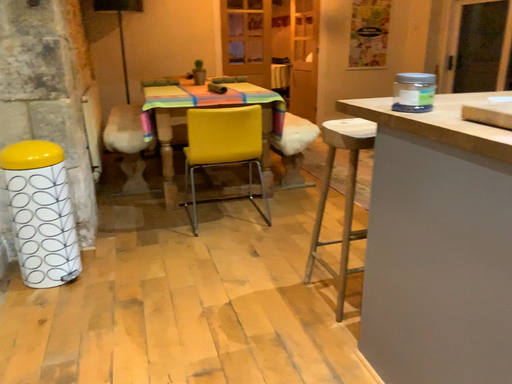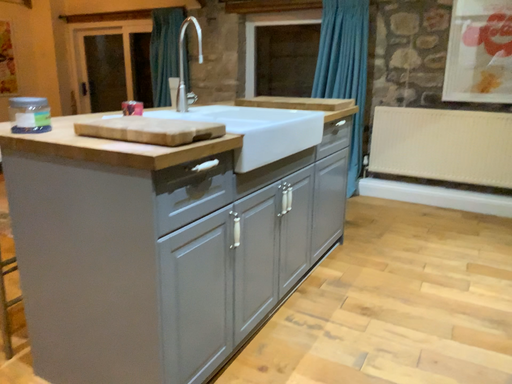
Question: Which way did the camera rotate in the video?

Choices:
 (A) rotated left
 (B) rotated right

Answer: (B)